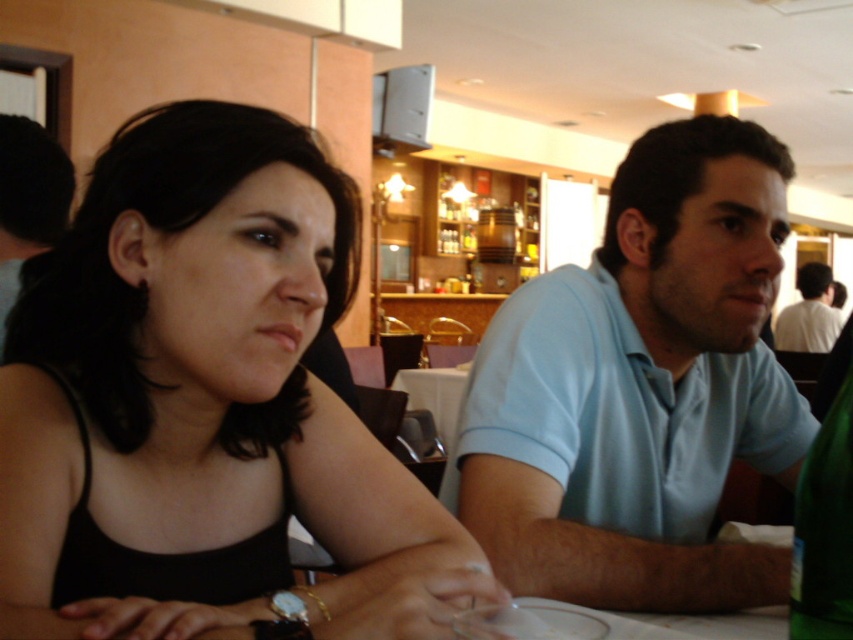
Does black matte tank top at center have a greater width compared to white shirt at upper right?

Incorrect, black matte tank top at center's width does not surpass white shirt at upper right's.

Is black matte tank top at center thinner than white shirt at upper right?

Correct, black matte tank top at center's width is less than white shirt at upper right's.

Does point (22, 532) lie behind point (824, 310)?

That is False.

Where is `black matte tank top at center`? black matte tank top at center is located at coordinates (206, 406).

Is green glass bottle at right to the left of black hair at left from the viewer's perspective?

Incorrect, green glass bottle at right is not on the left side of black hair at left.

Is green glass bottle at right below black hair at left?

Correct, green glass bottle at right is located below black hair at left.

Which is in front, point (810, 500) or point (18, 221)?

Point (810, 500)

Image resolution: width=853 pixels, height=640 pixels. I want to click on green glass bottle at right, so click(x=824, y=529).

Which is more to the left, light blue cotton shirt at center or black hair at left?

Positioned to the left is black hair at left.

Is light blue cotton shirt at center to the left of black hair at left from the viewer's perspective?

Incorrect, light blue cotton shirt at center is not on the left side of black hair at left.

Between point (788, 428) and point (4, 205), which one is positioned in front?

Positioned in front is point (788, 428).

What are the coordinates of `light blue cotton shirt at center` in the screenshot? It's located at (640, 388).